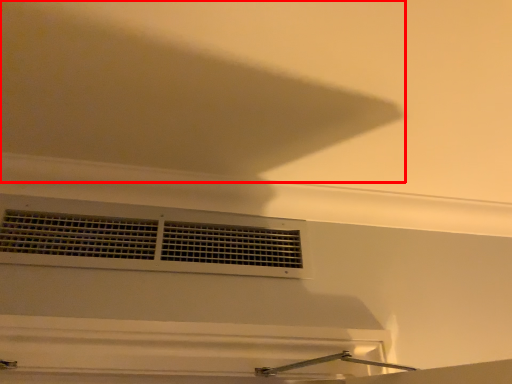
Question: From the image's perspective, where is exhaust hood (annotated by the red box) located in relation to window in the image?

Choices:
 (A) below
 (B) above

Answer: (B)